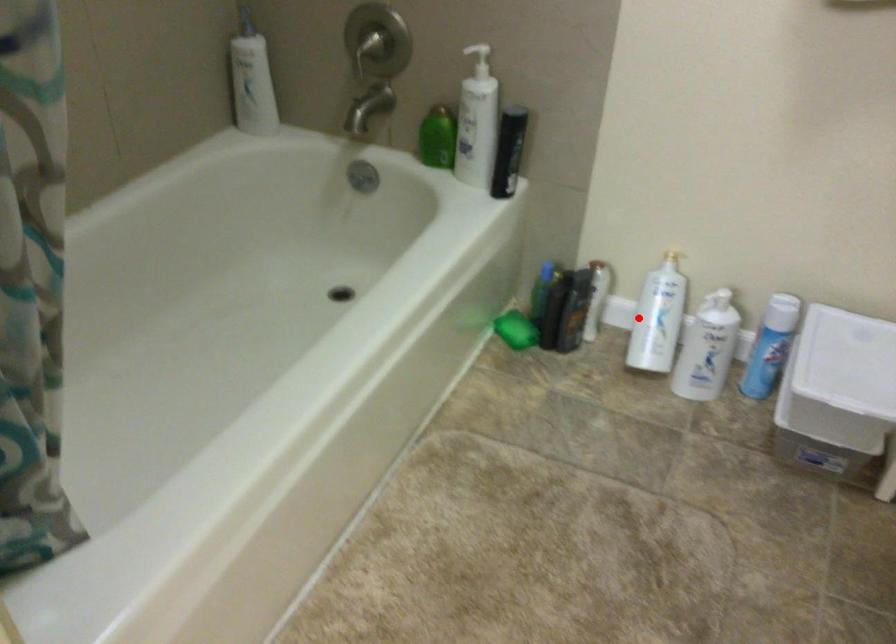
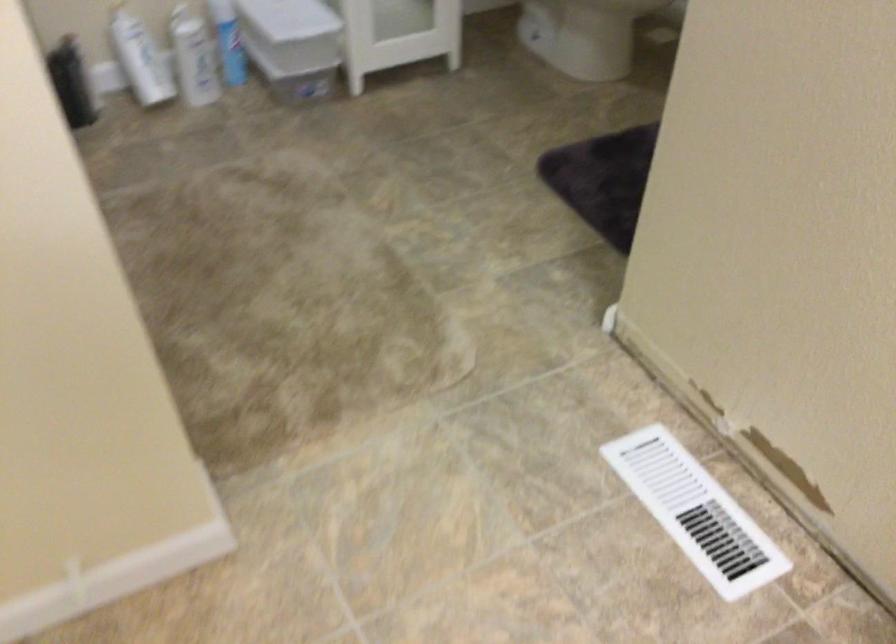
Locate, in the second image, the point that corresponds to the highlighted location in the first image.

(140, 59)